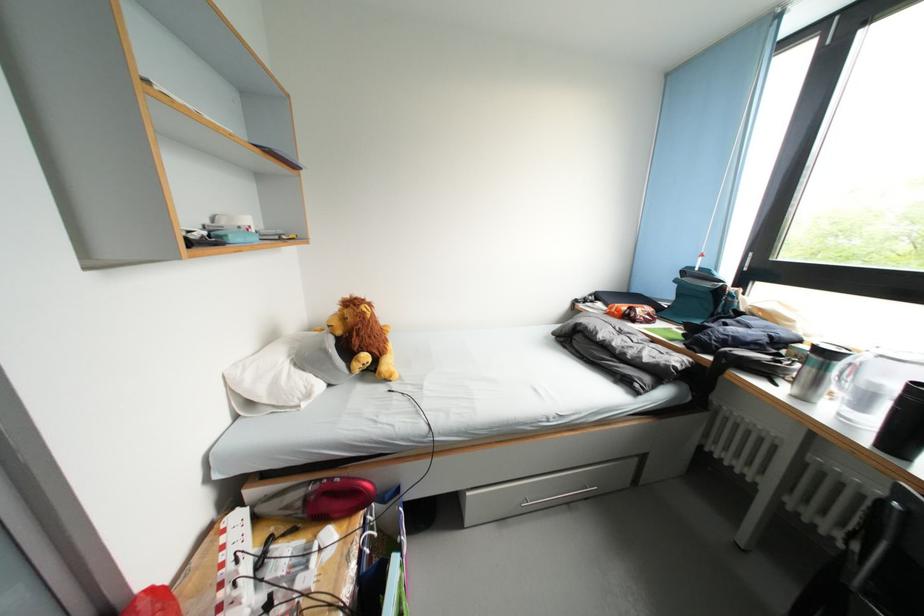
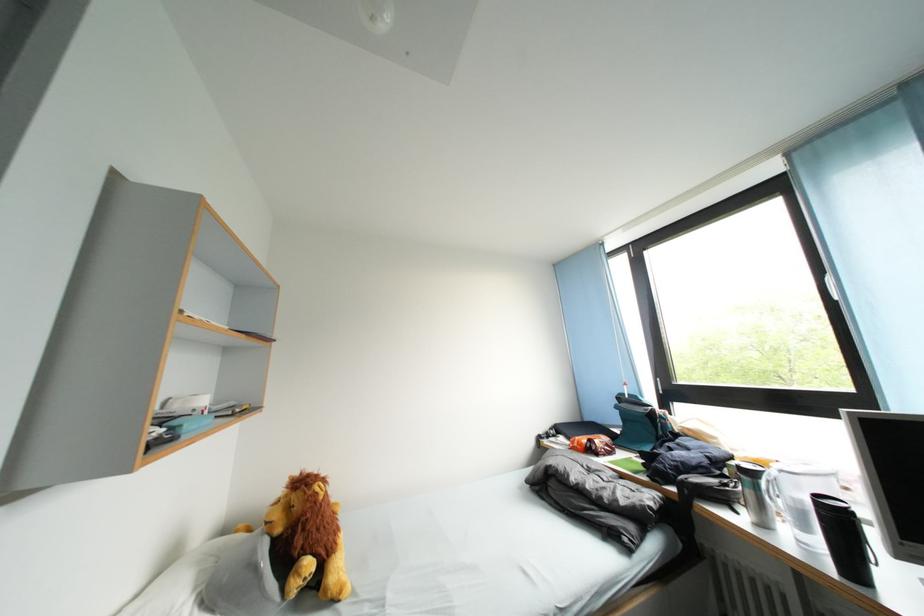
Question: Based on the continuous images, in which direction is the camera rotating? Reply with the corresponding letter.

Choices:
 (A) Left
 (B) Right
 (C) Up
 (D) Down

Answer: (C)